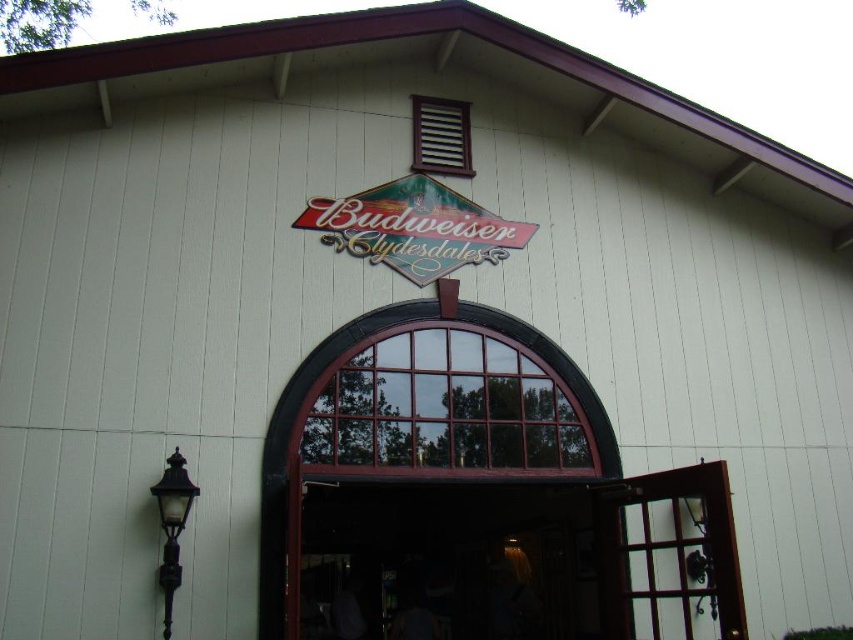
Between wooden door at center and shiny pink plastic sign at center, which one appears on the right side from the viewer's perspective?

From the viewer's perspective, wooden door at center appears more on the right side.

Is wooden door at center positioned in front of shiny pink plastic sign at center?

Yes, wooden door at center is in front of shiny pink plastic sign at center.

Is point (619, 508) farther from viewer compared to point (410, 228)?

No, (619, 508) is closer to viewer.

You are a GUI agent. You are given a task and a screenshot of the screen. Output one action in this format:
    pyautogui.click(x=<x>, y=<y>)
    Task: Click on the wooden door at center
    
    Given the screenshot: What is the action you would take?
    pyautogui.click(x=479, y=490)